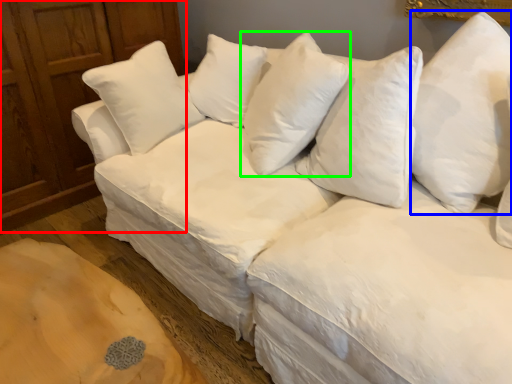
Question: Which object is positioned closest to dresser (highlighted by a red box)? Select from pillow (highlighted by a blue box) and pillow (highlighted by a green box).

Choices:
 (A) pillow
 (B) pillow

Answer: (B)